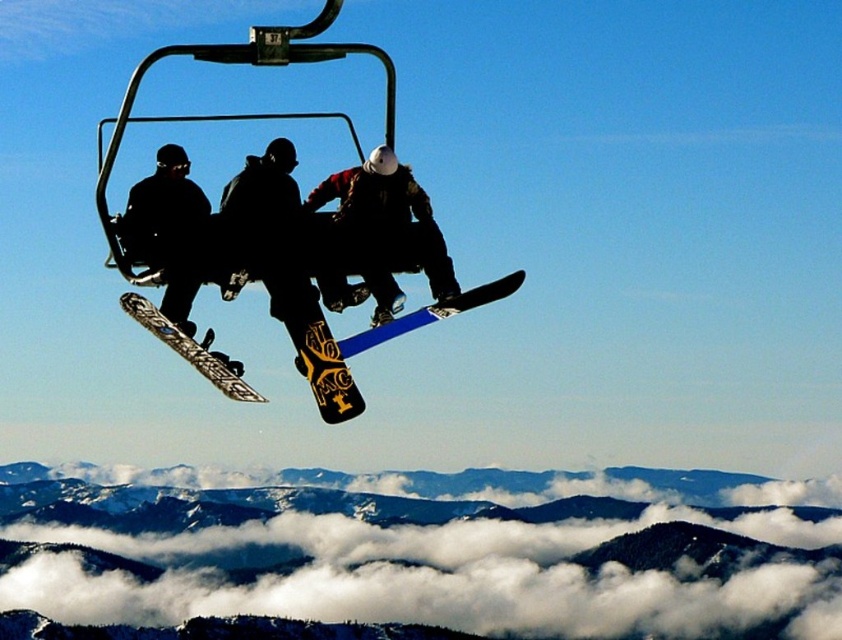
Between snowy forested mountain at lower center and yellow matte snowboard at center, which one has less height?

Standing shorter between the two is yellow matte snowboard at center.

Image resolution: width=842 pixels, height=640 pixels. What do you see at coordinates (419, 550) in the screenshot?
I see `snowy forested mountain at lower center` at bounding box center [419, 550].

Where is `snowy forested mountain at lower center`? The width and height of the screenshot is (842, 640). snowy forested mountain at lower center is located at coordinates (419, 550).

Locate an element on the screen. snowy forested mountain at lower center is located at coordinates (419, 550).

Is yellow matte snowboard at center taller than black matte snowboard at center?

Yes.

Can you confirm if yellow matte snowboard at center is positioned below black matte snowboard at center?

Actually, yellow matte snowboard at center is above black matte snowboard at center.

Who is more distant from viewer, [313,189] or [195,356]?

The point [313,189] is behind.

Locate an element on the screen. yellow matte snowboard at center is located at coordinates (385, 227).

Looking at this image, is snowy forested mountain at lower center closer to the viewer compared to black matte snowboard at center?

No.

From the picture: Is snowy forested mountain at lower center to the right of black matte snowboard at center from the viewer's perspective?

Incorrect, snowy forested mountain at lower center is not on the right side of black matte snowboard at center.

Does point (333, 566) come farther from viewer compared to point (226, 372)?

Yes, it is behind point (226, 372).

Where is `snowy forested mountain at lower center`? This screenshot has width=842, height=640. snowy forested mountain at lower center is located at coordinates (419, 550).